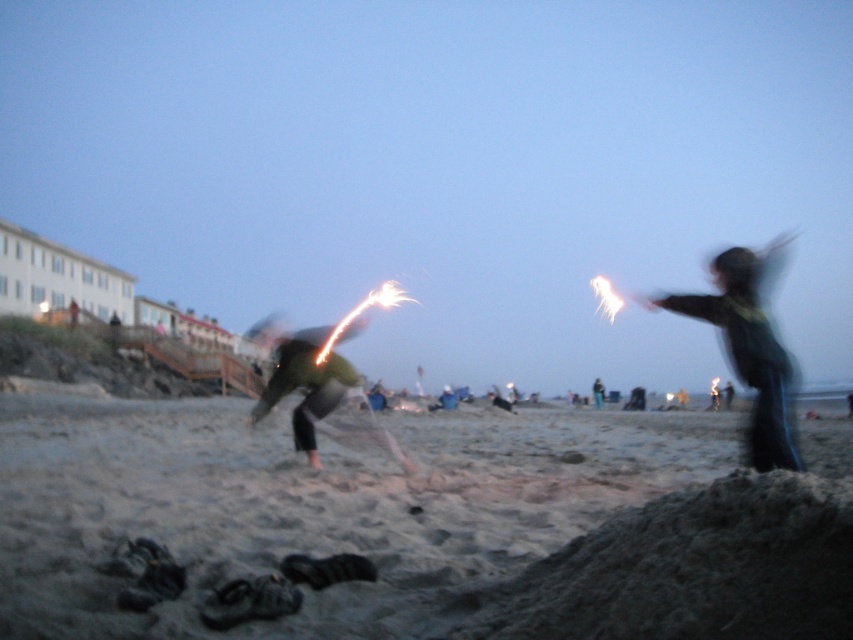
Does fine-grained sand at lower center have a lesser width compared to dark green fabric at right?

No, fine-grained sand at lower center is not thinner than dark green fabric at right.

Which is more to the left, fine-grained sand at lower center or dark green fabric at right?

fine-grained sand at lower center

Measure the distance between fine-grained sand at lower center and camera.

fine-grained sand at lower center and camera are 9.45 feet apart from each other.

Locate an element on the screen. fine-grained sand at lower center is located at coordinates (312, 506).

Between point (10, 464) and point (602, 385), which one is positioned in front?

Point (10, 464) is in front.

Does fine-grained sand at lower center have a lesser width compared to green fabric jacket at center?

In fact, fine-grained sand at lower center might be wider than green fabric jacket at center.

Which is behind, point (341, 477) or point (598, 397)?

Positioned behind is point (598, 397).

Locate an element on the screen. This screenshot has width=853, height=640. fine-grained sand at lower center is located at coordinates (312, 506).

Which is behind, point (775, 464) or point (601, 392)?

Point (601, 392)

Who is positioned more to the left, dark green fabric at right or green fabric jacket at center?

dark green fabric at right

The width and height of the screenshot is (853, 640). Describe the element at coordinates (749, 348) in the screenshot. I see `dark green fabric at right` at that location.

Image resolution: width=853 pixels, height=640 pixels. Find the location of `dark green fabric at right`. dark green fabric at right is located at coordinates (749, 348).